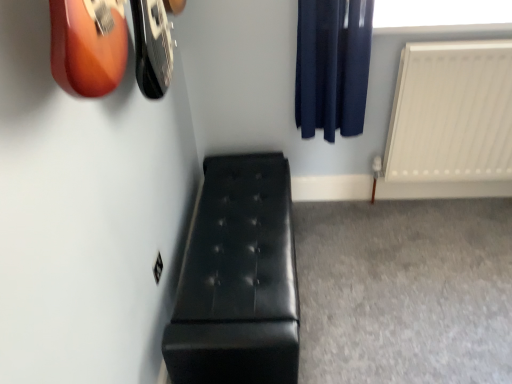
Question: From a real-world perspective, is white matte radiator at right physically below dark blue fabric curtain at upper right?

Choices:
 (A) yes
 (B) no

Answer: (A)

Question: Does white matte radiator at right lie behind dark blue fabric curtain at upper right?

Choices:
 (A) no
 (B) yes

Answer: (B)

Question: Is white matte radiator at right not inside dark blue fabric curtain at upper right?

Choices:
 (A) no
 (B) yes

Answer: (B)

Question: Considering the relative positions of white matte radiator at right and dark blue fabric curtain at upper right in the image provided, is white matte radiator at right to the left of dark blue fabric curtain at upper right from the viewer's perspective?

Choices:
 (A) yes
 (B) no

Answer: (B)

Question: From the image's perspective, does white matte radiator at right appear lower than dark blue fabric curtain at upper right?

Choices:
 (A) yes
 (B) no

Answer: (A)

Question: Is point (233, 200) closer or farther from the camera than point (356, 56)?

Choices:
 (A) closer
 (B) farther

Answer: (A)

Question: Is black leather bench at lower left taller or shorter than dark blue fabric curtain at upper right?

Choices:
 (A) short
 (B) tall

Answer: (A)

Question: Is black leather bench at lower left in front of or behind dark blue fabric curtain at upper right in the image?

Choices:
 (A) front
 (B) behind

Answer: (A)

Question: Considering the positions of black leather bench at lower left and dark blue fabric curtain at upper right in the image, is black leather bench at lower left wider or thinner than dark blue fabric curtain at upper right?

Choices:
 (A) wide
 (B) thin

Answer: (A)

Question: Is transparent plastic window screen at upper right taller or shorter than dark blue fabric curtain at upper right?

Choices:
 (A) tall
 (B) short

Answer: (B)

Question: Is point (503, 18) closer or farther from the camera than point (312, 41)?

Choices:
 (A) closer
 (B) farther

Answer: (B)

Question: Is transparent plastic window screen at upper right bigger or smaller than dark blue fabric curtain at upper right?

Choices:
 (A) small
 (B) big

Answer: (A)

Question: From the image's perspective, is transparent plastic window screen at upper right above or below dark blue fabric curtain at upper right?

Choices:
 (A) above
 (B) below

Answer: (A)

Question: Is black leather bench at lower left spatially inside white matte radiator at right, or outside of it?

Choices:
 (A) inside
 (B) outside

Answer: (B)

Question: In terms of width, does black leather bench at lower left look wider or thinner when compared to white matte radiator at right?

Choices:
 (A) thin
 (B) wide

Answer: (B)